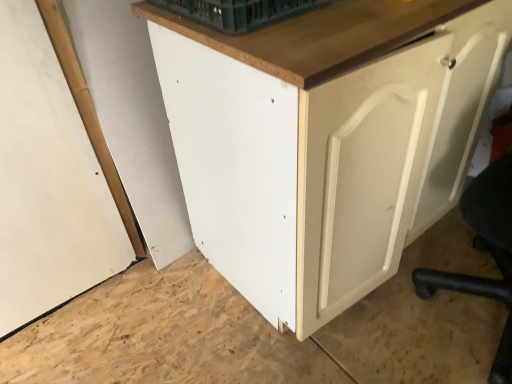
Identify the location of free space in front of green plastic basket at upper center. [x=290, y=38].